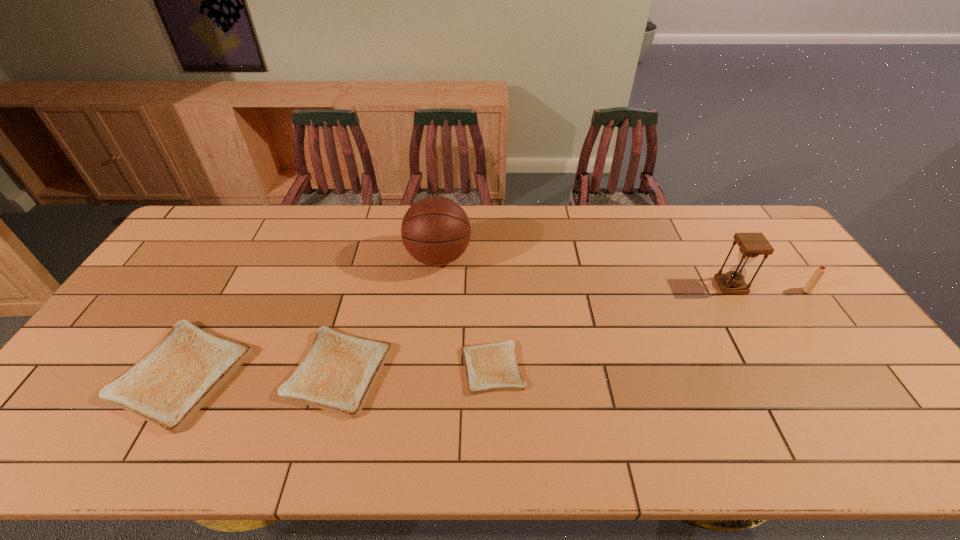
You are a GUI agent. You are given a task and a screenshot of the screen. Output one action in this format:
    pyautogui.click(x=<x>, y=<y>)
    Task: Click on the free space between the second tallest object and the rightmost toast
    Image resolution: width=960 pixels, height=540 pixels.
    Given the screenshot: What is the action you would take?
    pyautogui.click(x=612, y=327)

Locate an element on the screen. vacant space that is in between the second shortest toast and the leftmost object is located at coordinates (260, 372).

You are a GUI agent. You are given a task and a screenshot of the screen. Output one action in this format:
    pyautogui.click(x=<x>, y=<y>)
    Task: Click on the free spot between the fifth tallest object and the hourglass
    Image resolution: width=960 pixels, height=540 pixels.
    Given the screenshot: What is the action you would take?
    pyautogui.click(x=535, y=328)

This screenshot has width=960, height=540. Find the location of `vacant area that lies between the second toast from right to left and the third tallest object`. vacant area that lies between the second toast from right to left and the third tallest object is located at coordinates (573, 330).

You are a GUI agent. You are given a task and a screenshot of the screen. Output one action in this format:
    pyautogui.click(x=<x>, y=<y>)
    Task: Click on the object identified as the second closest to the rightmost toast
    The image size is (960, 540).
    Given the screenshot: What is the action you would take?
    pyautogui.click(x=435, y=230)

You are a GUI agent. You are given a task and a screenshot of the screen. Output one action in this format:
    pyautogui.click(x=<x>, y=<y>)
    Task: Click on the object that ranks as the third closest to the leftmost object
    
    Given the screenshot: What is the action you would take?
    pyautogui.click(x=490, y=367)

Locate which toast ranks in proximity to the igniter. Please provide its 2D coordinates. Your answer should be formatted as a tuple, i.e. [(x, y)], where the tuple contains the x and y coordinates of a point satisfying the conditions above.

[(490, 367)]

Identify the location of toast that is the second closest to the leftmost toast. (490, 367).

The height and width of the screenshot is (540, 960). Identify the location of blank area in the image that satisfies the following two spatial constraints: 1. on the back side of the basketball; 2. on the right side of the second shortest toast. (369, 258).

Find the location of a particular element. This screenshot has height=540, width=960. free space that satisfies the following two spatial constraints: 1. on the back side of the second toast from right to left; 2. on the right side of the tallest object is located at coordinates (369, 258).